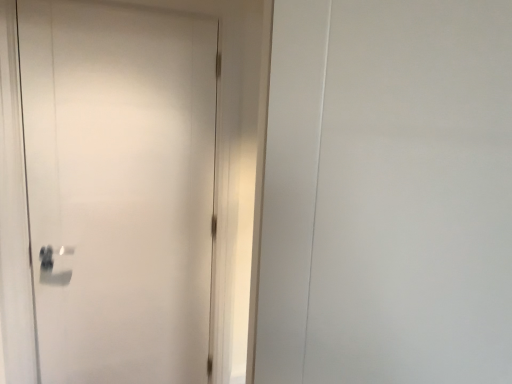
Question: Should I look upward or downward to see white matte door at left?

Choices:
 (A) up
 (B) down

Answer: (B)